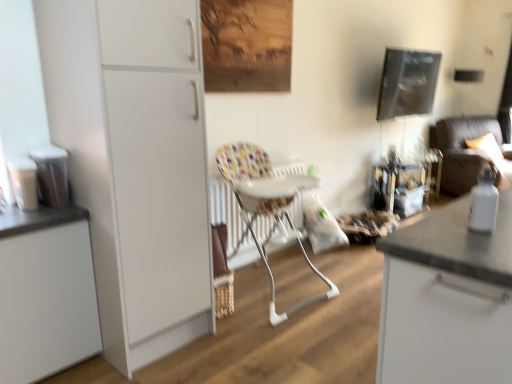
Image resolution: width=512 pixels, height=384 pixels. I want to click on free spot below printed fabric highchair at center (from a real-world perspective), so click(267, 293).